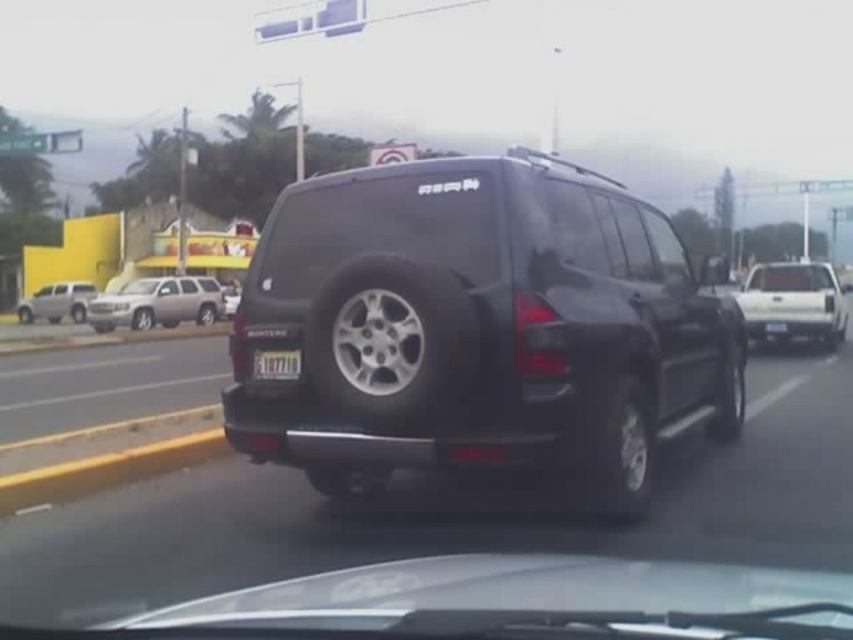
You are a passenger in the vehicle and want to look through the transparent glass windshield at center to see the road ahead. Where exactly should you look on the windshield to see the black SUV ahead?

You should look at the point located at (x=612, y=234) on the transparent glass windshield at center to see the black SUV ahead.

You are a driver who wants to check the position of the transparent glass windshield at center. What are its coordinates?

The transparent glass windshield at center is located at coordinates point [612,234].